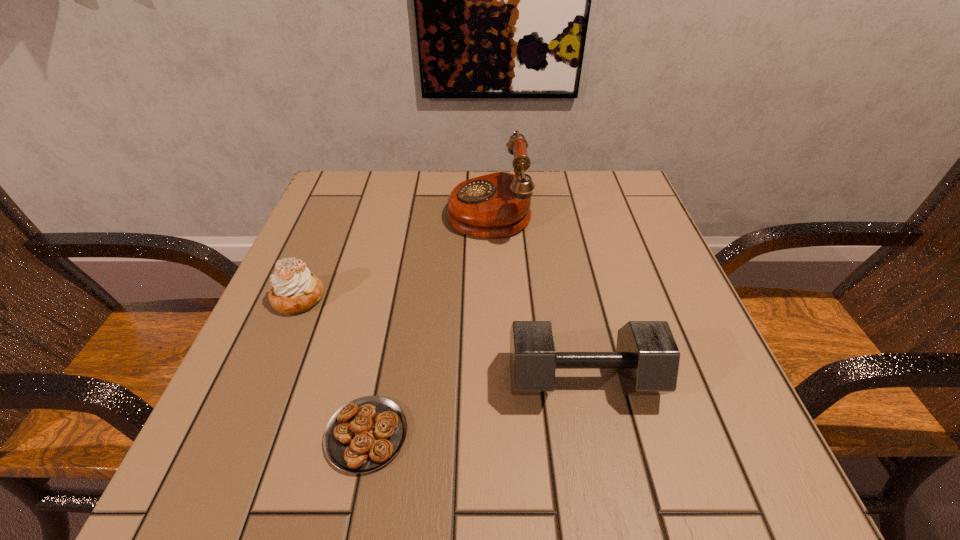
The width and height of the screenshot is (960, 540). What are the coordinates of `free space between the shorter pastry and the tallest object` in the screenshot? It's located at (428, 322).

Identify the location of vacant area between the left pastry and the shorter pastry. (332, 367).

Find the location of a particular element. The height and width of the screenshot is (540, 960). the second closest object to the right pastry is located at coordinates point(294,290).

Locate which object is the closest to the second shortest object. Please provide its 2D coordinates. Your answer should be formatted as a tuple, i.e. [(x, y)], where the tuple contains the x and y coordinates of a point satisfying the conditions above.

[(365, 434)]

The height and width of the screenshot is (540, 960). Identify the location of vacant area that satisfies the following two spatial constraints: 1. on the front side of the dumbbell; 2. on the left side of the leftmost object. (265, 379).

Locate an element on the screen. This screenshot has width=960, height=540. vacant space that satisfies the following two spatial constraints: 1. on the back side of the third shortest object; 2. on the left side of the nearer pastry is located at coordinates (378, 379).

Locate an element on the screen. Image resolution: width=960 pixels, height=540 pixels. free location that satisfies the following two spatial constraints: 1. on the dial of the telephone; 2. on the front side of the farther pastry is located at coordinates (492, 298).